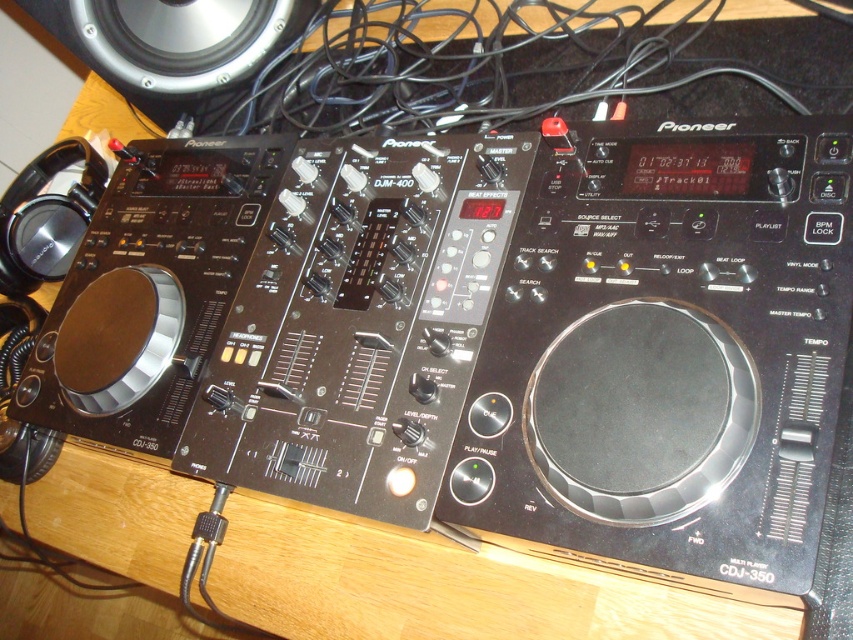
Does black plastic wire at upper center have a lesser height compared to silver metallic speaker at upper left?

No.

Between black plastic wire at upper center and silver metallic speaker at upper left, which one has more height?

Standing taller between the two is black plastic wire at upper center.

Find the location of `black plastic wire at upper center`. black plastic wire at upper center is located at coordinates (535, 64).

Locate an element on the screen. The image size is (853, 640). black plastic wire at upper center is located at coordinates (535, 64).